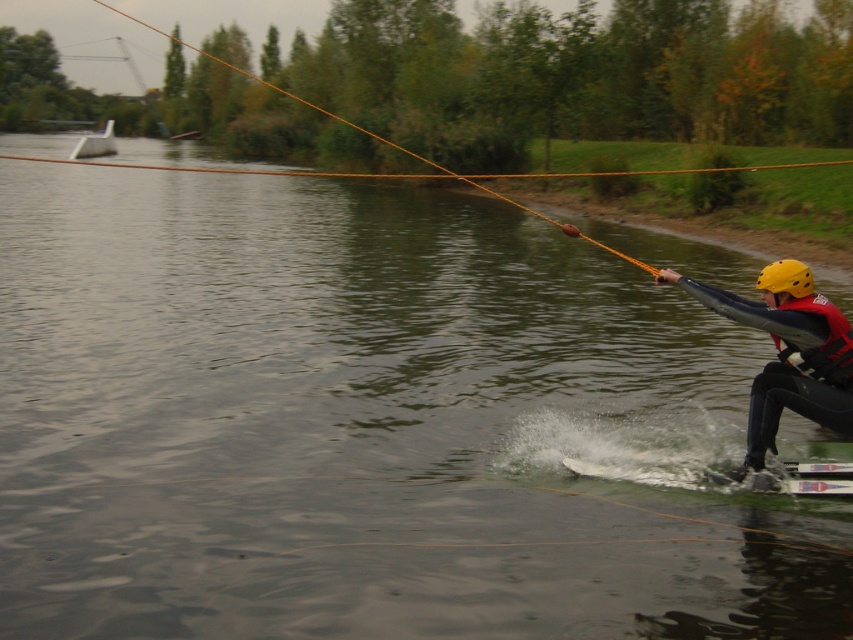
Can you confirm if orange rope at upper center is positioned below white plastic boat at upper left?

No.

Measure the distance between point (624, 259) and camera.

Point (624, 259) is 8.02 meters away from camera.

I want to click on orange rope at upper center, so click(389, 141).

Who is positioned more to the left, black matte wetsuit at lower right or red matte life jacket at right?

black matte wetsuit at lower right

Which is below, black matte wetsuit at lower right or red matte life jacket at right?

black matte wetsuit at lower right

Locate an element on the screen. black matte wetsuit at lower right is located at coordinates (786, 353).

Where is `black matte wetsuit at lower right`? Image resolution: width=853 pixels, height=640 pixels. black matte wetsuit at lower right is located at coordinates pyautogui.click(x=786, y=353).

Does black matte wetsuit at lower right have a larger size compared to white plastic boat at upper left?

No, black matte wetsuit at lower right is not bigger than white plastic boat at upper left.

Which is behind, point (793, 344) or point (90, 148)?

The point (90, 148) is more distant.

Is point (728, 316) closer to viewer compared to point (94, 136)?

Yes, it is.

The image size is (853, 640). I want to click on black matte wetsuit at lower right, so click(786, 353).